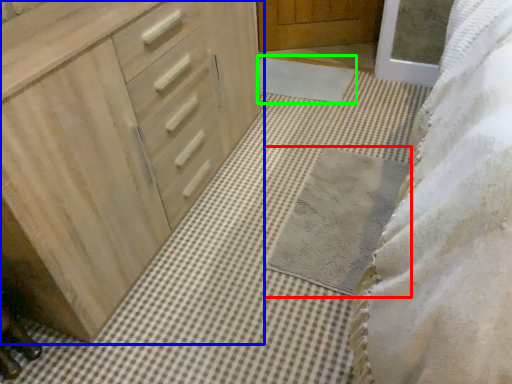
Question: Estimate the real-world distances between objects in this image. Which object is closer to bath mat (highlighted by a red box), chest of drawers (highlighted by a blue box) or bath mat (highlighted by a green box)?

Choices:
 (A) chest of drawers
 (B) bath mat

Answer: (A)